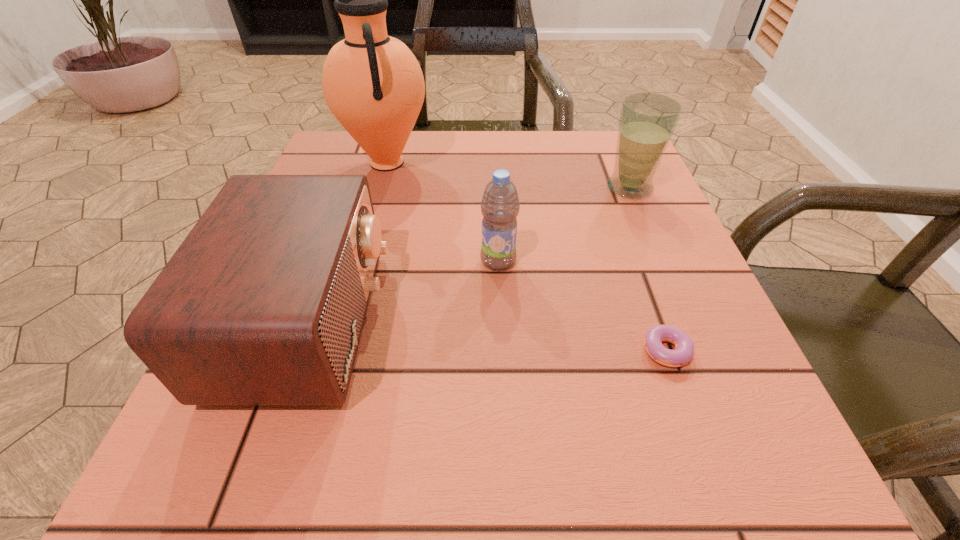
The width and height of the screenshot is (960, 540). I want to click on the tallest object, so click(x=373, y=84).

The width and height of the screenshot is (960, 540). Identify the location of glass. (647, 122).

Where is `water bottle`? The width and height of the screenshot is (960, 540). water bottle is located at coordinates (500, 205).

Identify the location of radio receiver. This screenshot has width=960, height=540. (263, 303).

Where is `doughnut`? This screenshot has width=960, height=540. doughnut is located at coordinates (684, 348).

This screenshot has height=540, width=960. I want to click on free space located 0.400m on the front of the pitcher, so click(x=333, y=353).

The width and height of the screenshot is (960, 540). Find the location of `vacant space situated on the left of the glass`. vacant space situated on the left of the glass is located at coordinates (441, 188).

The width and height of the screenshot is (960, 540). Find the location of `free location located 0.160m on the left of the third object from right to left`. free location located 0.160m on the left of the third object from right to left is located at coordinates (387, 260).

This screenshot has width=960, height=540. What are the coordinates of `free space located 0.050m on the front panel of the radio receiver` in the screenshot? It's located at (412, 321).

The height and width of the screenshot is (540, 960). What are the coordinates of `vacant region located on the back of the shortest object` in the screenshot? It's located at (613, 193).